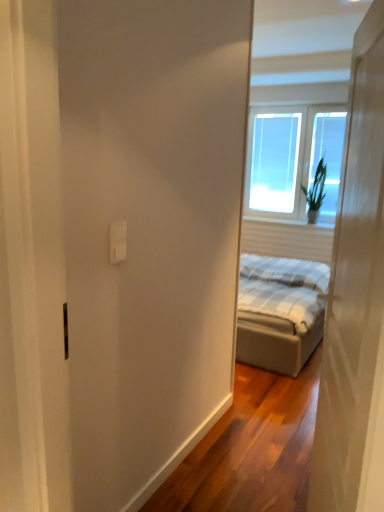
Question: Considering the relative sizes of transparent glass window at upper right and white plastic outlet at upper center in the image provided, is transparent glass window at upper right wider than white plastic outlet at upper center?

Choices:
 (A) no
 (B) yes

Answer: (B)

Question: From a real-world perspective, does transparent glass window at upper right stand above white plastic outlet at upper center?

Choices:
 (A) yes
 (B) no

Answer: (A)

Question: Is transparent glass window at upper right positioned with its back to white plastic outlet at upper center?

Choices:
 (A) yes
 (B) no

Answer: (B)

Question: From a real-world perspective, is transparent glass window at upper right under white plastic outlet at upper center?

Choices:
 (A) yes
 (B) no

Answer: (B)

Question: Does transparent glass window at upper right turn towards white plastic outlet at upper center?

Choices:
 (A) yes
 (B) no

Answer: (A)

Question: Is white matte door at right wider or thinner than green leafy plant at upper right?

Choices:
 (A) wide
 (B) thin

Answer: (B)

Question: Is point (340, 283) positioned closer to the camera than point (322, 156)?

Choices:
 (A) closer
 (B) farther

Answer: (A)

Question: Is white matte door at right in front of or behind green leafy plant at upper right in the image?

Choices:
 (A) behind
 (B) front

Answer: (B)

Question: Do you think white matte door at right is within green leafy plant at upper right, or outside of it?

Choices:
 (A) outside
 (B) inside

Answer: (A)

Question: Choose the correct answer: Is green leafy plant at upper right inside white plastic outlet at upper center or outside it?

Choices:
 (A) inside
 (B) outside

Answer: (B)

Question: Does point (321, 179) appear closer or farther from the camera than point (124, 239)?

Choices:
 (A) farther
 (B) closer

Answer: (A)

Question: In the image, is green leafy plant at upper right positioned in front of or behind white plastic outlet at upper center?

Choices:
 (A) behind
 (B) front

Answer: (A)

Question: Considering the positions of green leafy plant at upper right and white plastic outlet at upper center in the image, is green leafy plant at upper right bigger or smaller than white plastic outlet at upper center?

Choices:
 (A) big
 (B) small

Answer: (A)

Question: From their relative heights in the image, would you say green leafy plant at upper right is taller or shorter than transparent glass window at center?

Choices:
 (A) tall
 (B) short

Answer: (B)

Question: From the image's perspective, is green leafy plant at upper right located above or below transparent glass window at center?

Choices:
 (A) above
 (B) below

Answer: (B)